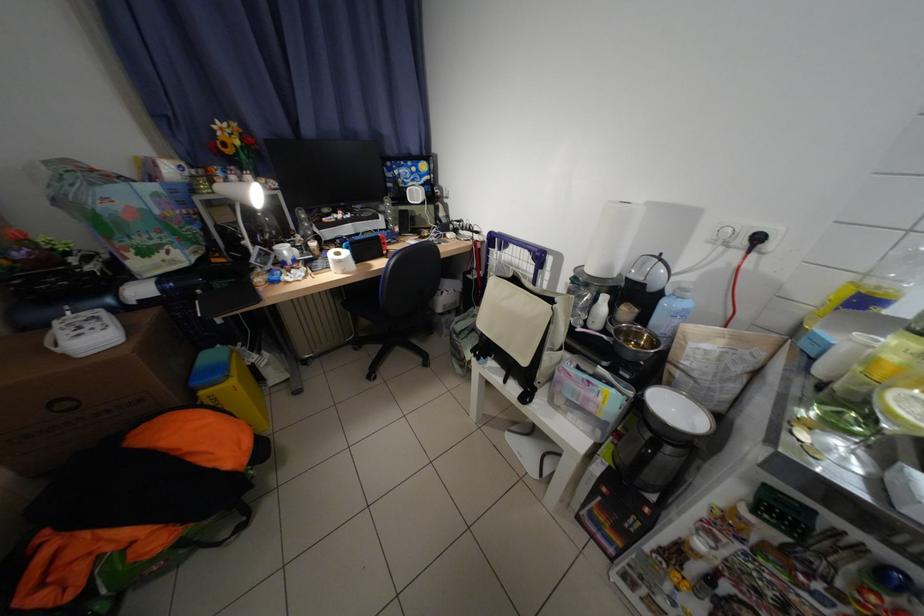
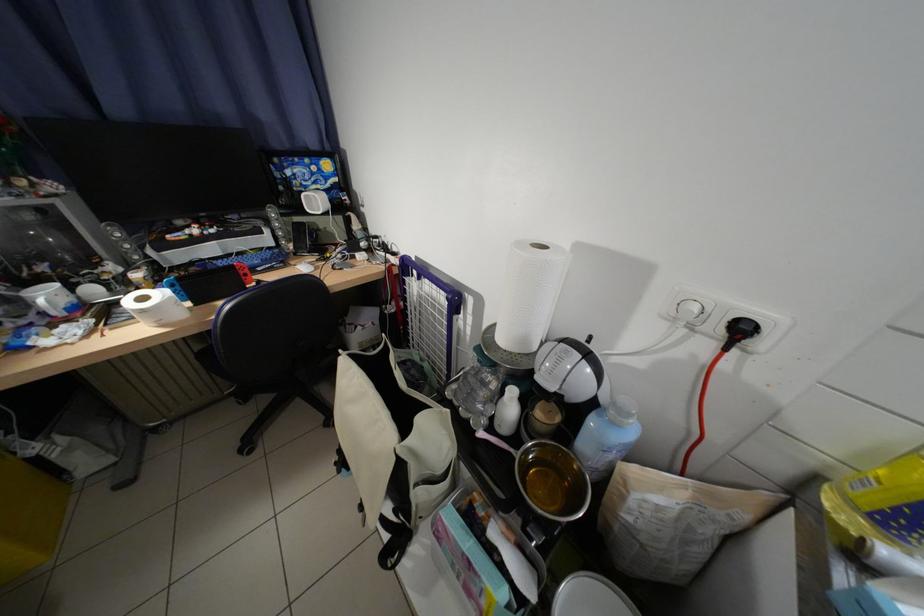
Based on the photo, which direction would the cameraman need to move to produce the second image?

The cameraman walked toward right, forward.